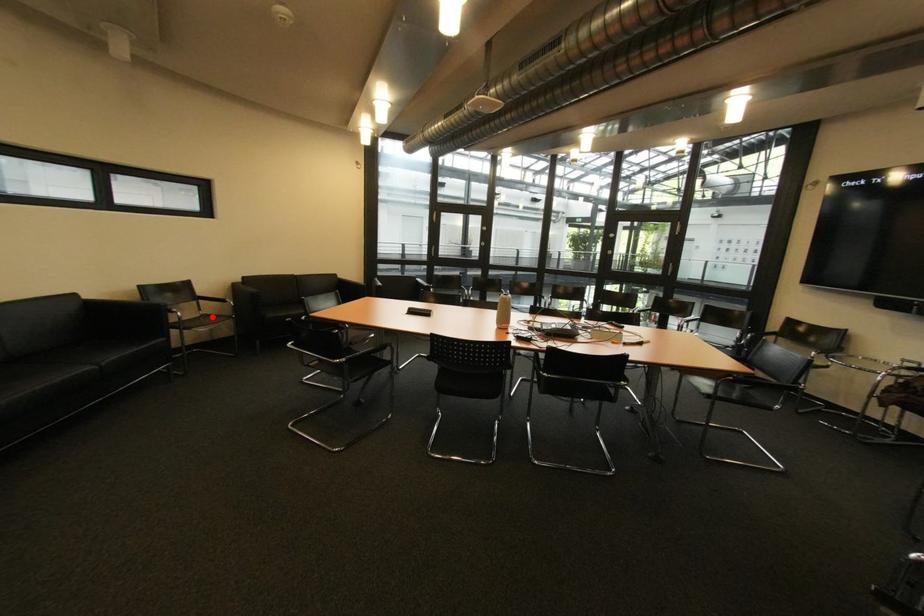
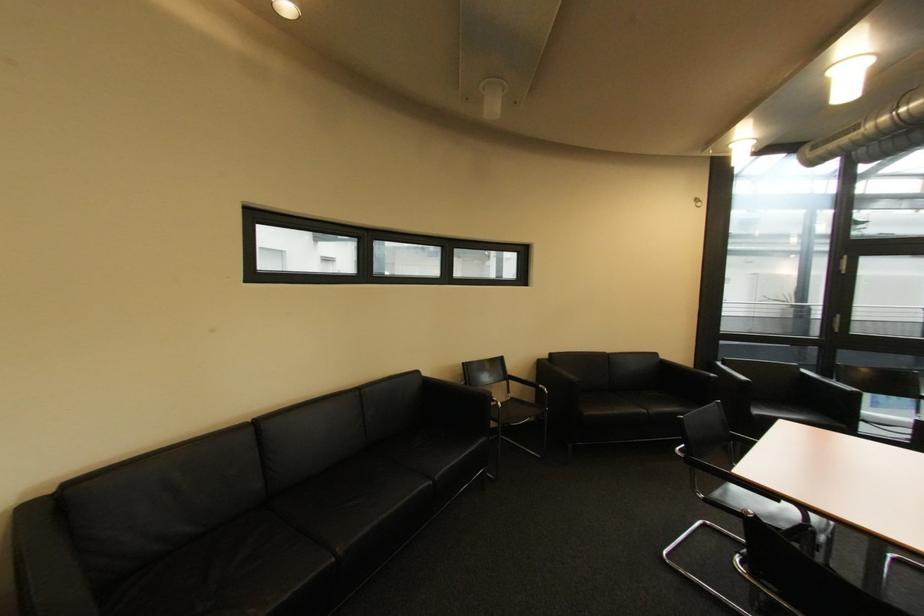
Question: I am providing you with two images of the same scene from different viewpoints. A red point is marked on the first image. At the location where the point appears in image 1, is it still visible in image 2?

Choices:
 (A) Yes
 (B) No

Answer: (A)